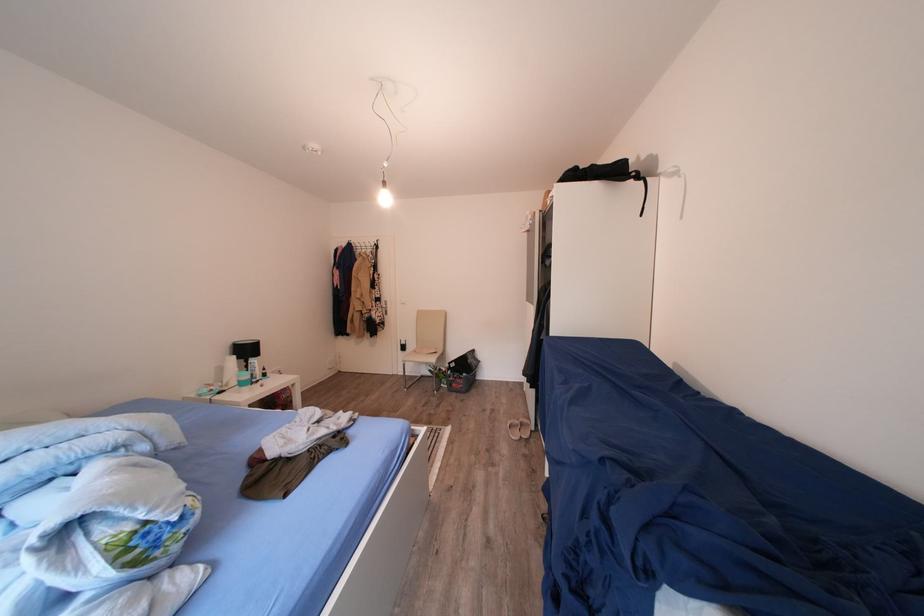
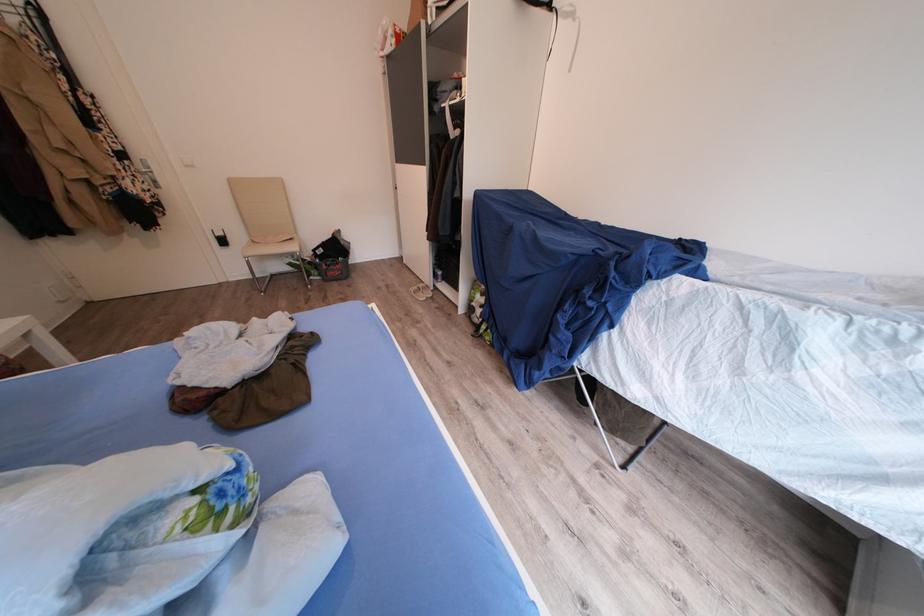
The point at (142, 538) is marked in the first image. Where is the corresponding point in the second image?

(213, 507)